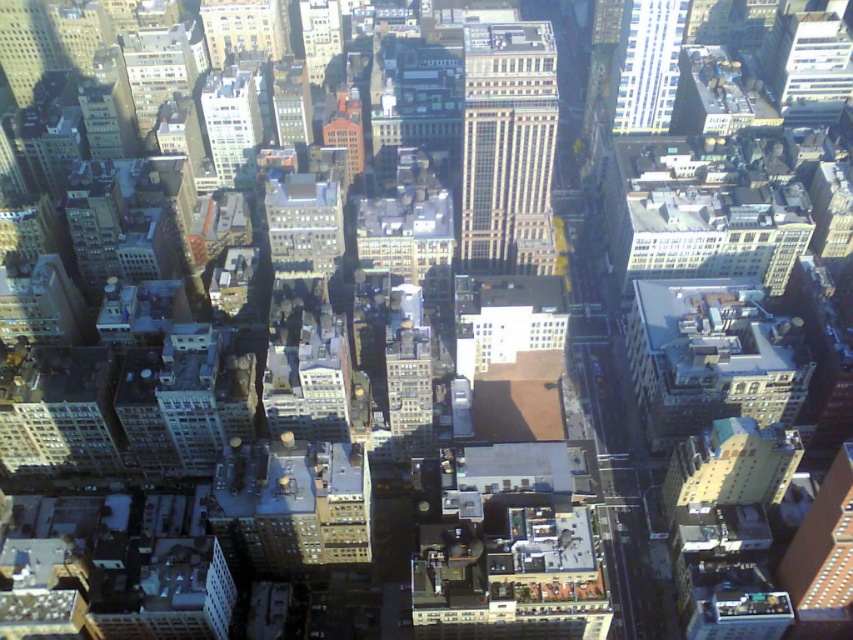
You are a drone operator trying to navigate between two points in the city. You need to fly from point A to point B. Given that point A is at coordinates point [415,442] and point B is at coordinates point [225,77], which point is closer to your current position if you are at the camera position?

Point [415,442] is closer to the camera than point [225,77], so you should start by flying towards point A first.

You are a drone operator trying to navigate between two points in the city. You see the point at coordinates point (619, 104) and point (242, 96). Which point is closer to your current position at the camera?

Point (242, 96) is closer to the camera because it is less further away than point (619, 104).

You are a city planner analyzing an aerial map of a city. You need to locate the brick building at center. What are its coordinates?

The coordinates of the brick building at center are at point (409, 385).